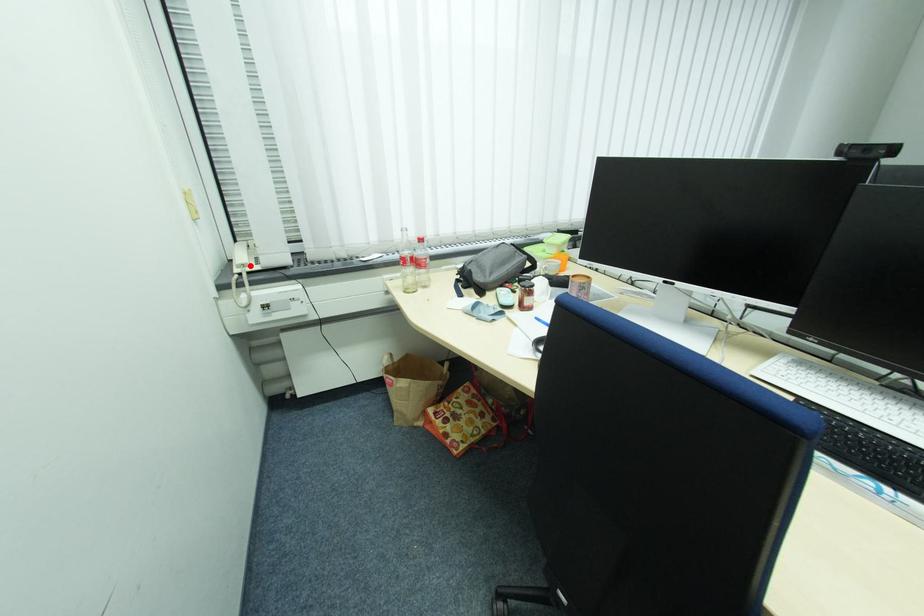
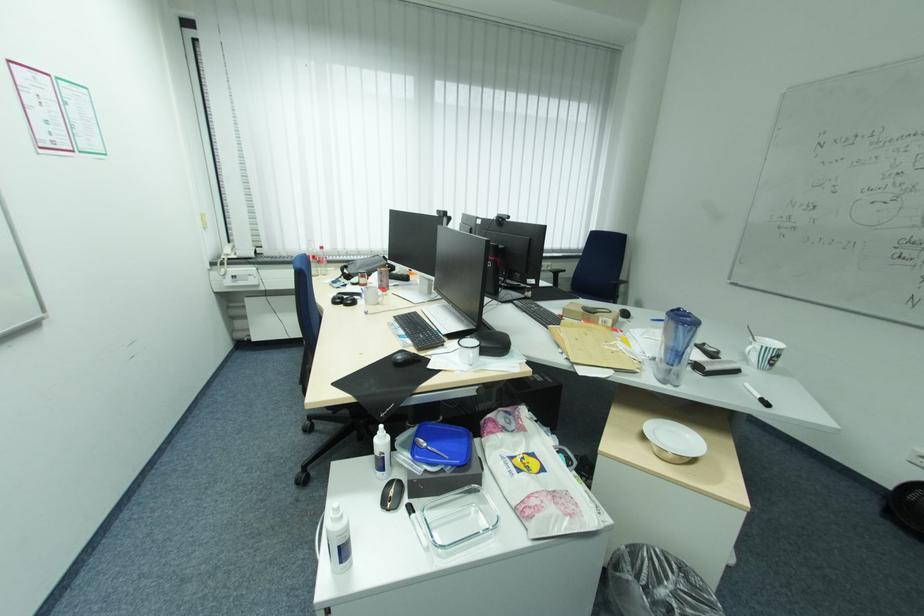
In the second image, find the point that corresponds to the highlighted location in the first image.

(234, 254)